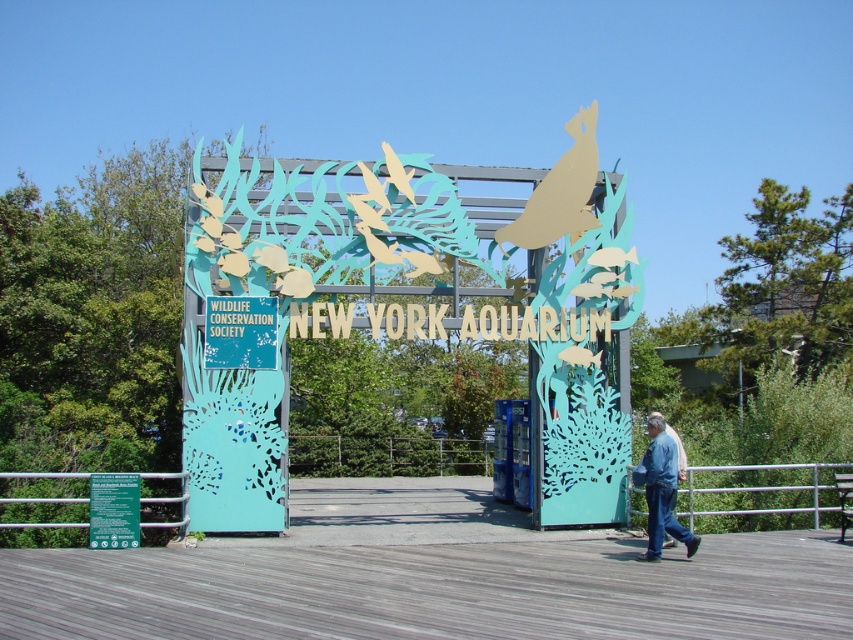
Question: Can you confirm if blue paper sign at center is thinner than blue jeans at lower right?

Choices:
 (A) yes
 (B) no

Answer: (B)

Question: Which of these objects is positioned farthest from the blue paper sign at center?

Choices:
 (A) metallic blue sign at center
 (B) blue jeans at lower right

Answer: (A)

Question: Among these objects, which one is nearest to the camera?

Choices:
 (A) blue paper sign at center
 (B) metallic blue sign at center
 (C) blue jeans at lower right

Answer: (C)

Question: From the image, what is the correct spatial relationship of blue paper sign at center in relation to blue jeans at lower right?

Choices:
 (A) above
 (B) below

Answer: (A)

Question: Does metallic blue sign at center come in front of blue jeans at lower right?

Choices:
 (A) yes
 (B) no

Answer: (B)

Question: Which point is farther to the camera?

Choices:
 (A) blue jeans at lower right
 (B) metallic blue sign at center
 (C) blue paper sign at center

Answer: (B)